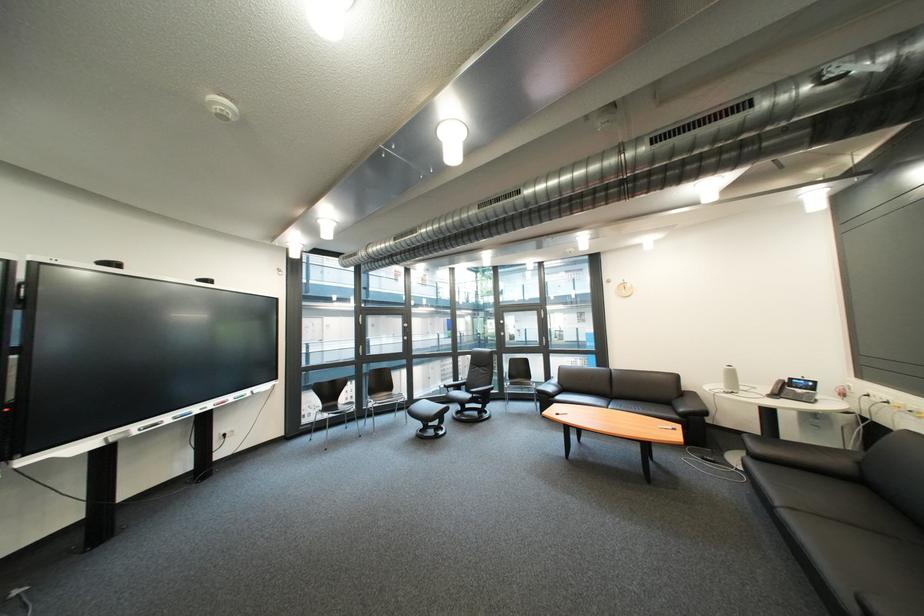
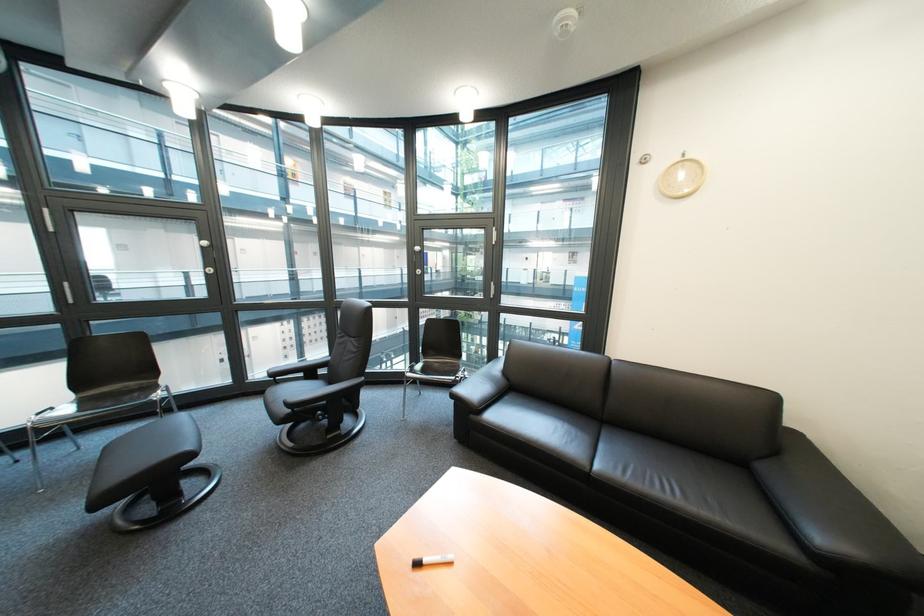
The point at (564, 400) is marked in the first image. Where is the corresponding point in the second image?

(485, 418)